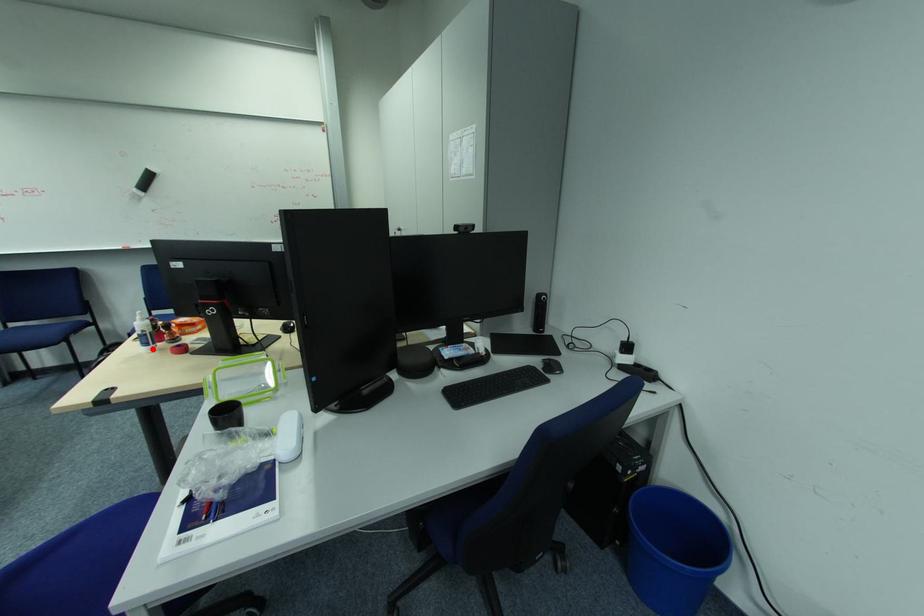
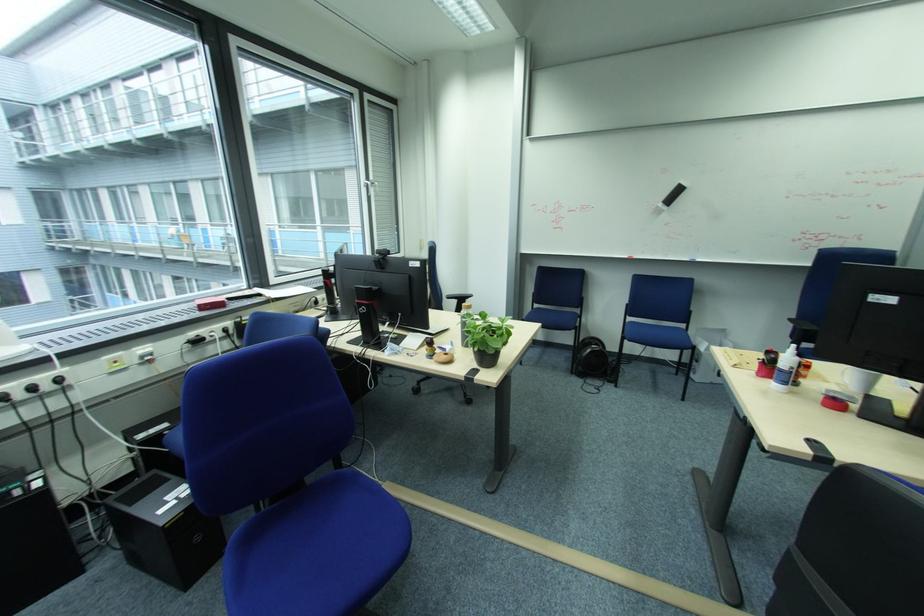
In the second image, find the point that corresponds to the highlighted location in the first image.

(784, 387)